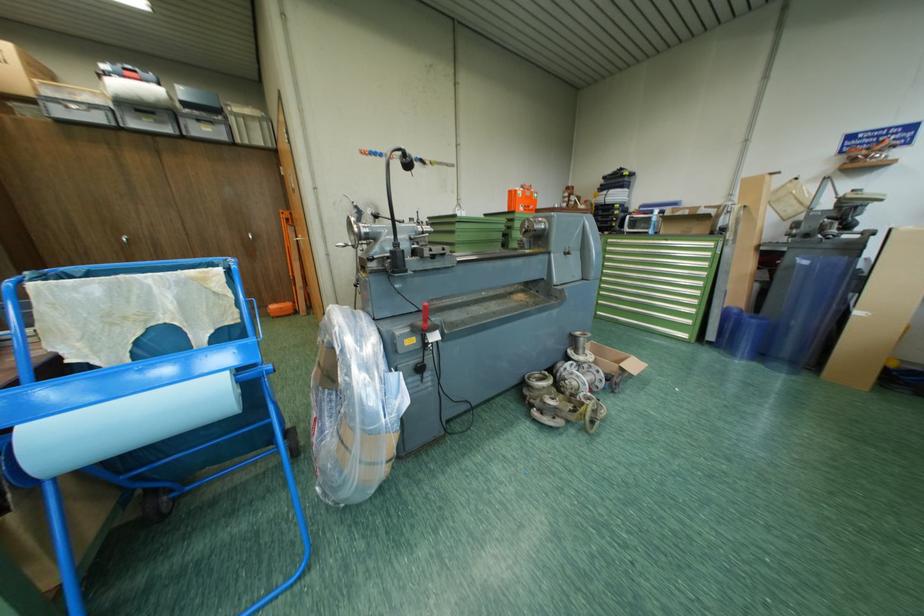
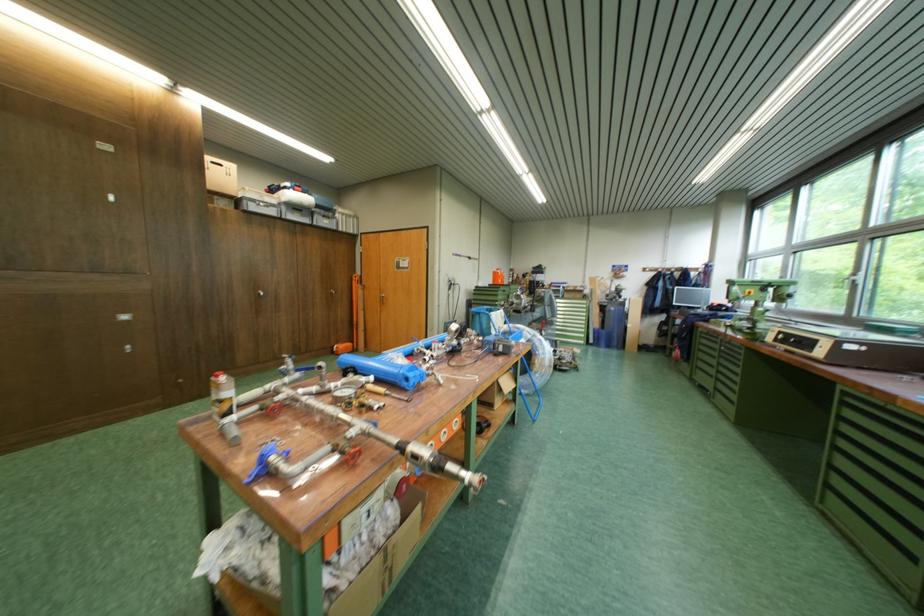
Which direction would the cameraman need to move to produce the second image?

The cameraman moved toward left, backward.